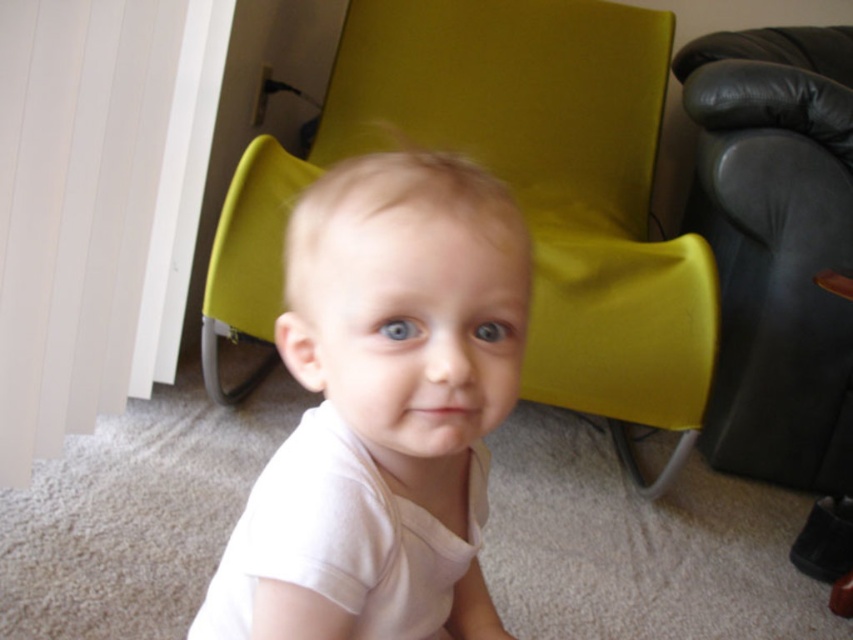
Is white cotton shirt at center in front of matte green armchair at center?

Yes.

Who is taller, white cotton shirt at center or matte green armchair at center?

With more height is matte green armchair at center.

What do you see at coordinates (383, 410) in the screenshot? The height and width of the screenshot is (640, 853). I see `white cotton shirt at center` at bounding box center [383, 410].

Identify the location of white cotton shirt at center. (383, 410).

Who is positioned more to the right, matte green armchair at center or black leather couch at right?

black leather couch at right is more to the right.

Image resolution: width=853 pixels, height=640 pixels. Find the location of `matte green armchair at center`. matte green armchair at center is located at coordinates (514, 189).

Is white cotton shirt at center bigger than black leather couch at right?

Actually, white cotton shirt at center might be smaller than black leather couch at right.

Can you confirm if white cotton shirt at center is positioned below black leather couch at right?

Correct, white cotton shirt at center is located below black leather couch at right.

Locate an element on the screen. Image resolution: width=853 pixels, height=640 pixels. white cotton shirt at center is located at coordinates (383, 410).

Identify the location of white cotton shirt at center. The height and width of the screenshot is (640, 853). (383, 410).